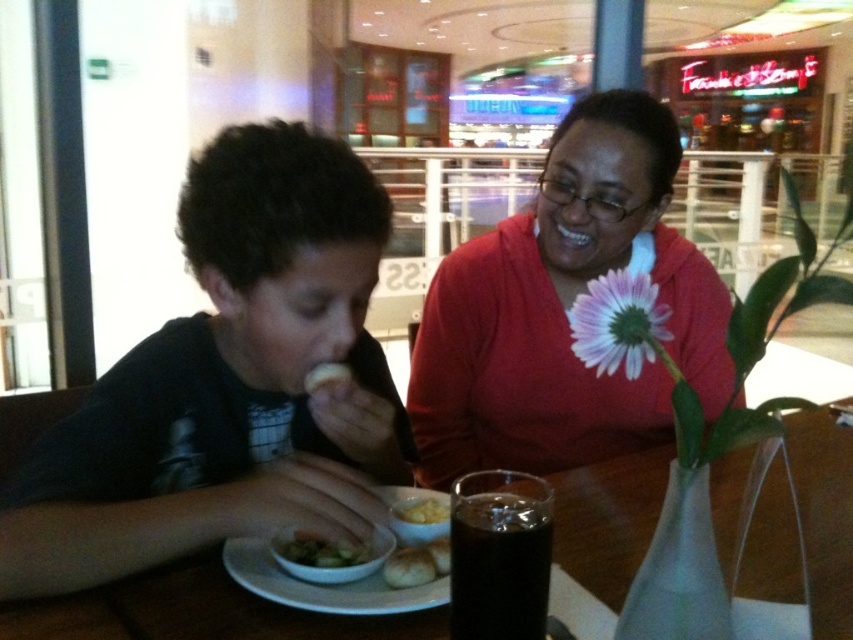
Question: Is yellow matte potato at center above white matte bread at lower center?

Choices:
 (A) yes
 (B) no

Answer: (A)

Question: Which object is farther from the camera taking this photo?

Choices:
 (A) golden brown bread at lower center
 (B) dark glass cup at center

Answer: (A)

Question: Can you confirm if matte red shirt at upper center is bigger than dark glass cup at center?

Choices:
 (A) yes
 (B) no

Answer: (A)

Question: Which point is closer to the camera taking this photo?

Choices:
 (A) (328, 372)
 (B) (94, 609)
 (C) (310, 284)
 (D) (485, 563)

Answer: (D)

Question: Which object is farther from the camera taking this photo?

Choices:
 (A) white matte flower at upper center
 (B) white matte bread at lower center

Answer: (A)

Question: Can you confirm if dark glass cup at center is positioned below golden brown bread at lower center?

Choices:
 (A) yes
 (B) no

Answer: (B)